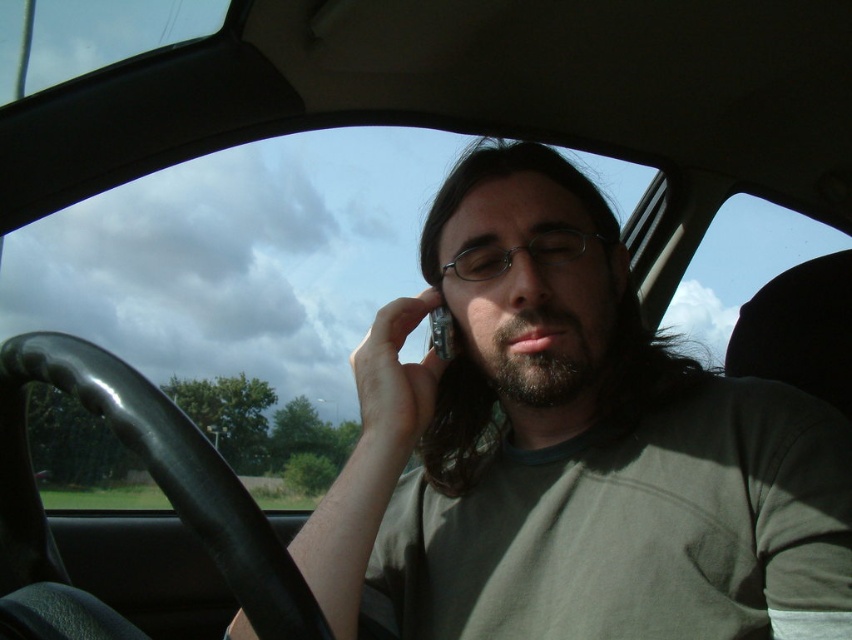
You are a passenger in the car and want to look outside through the transparent glass car window at upper center. Where exactly should you look to see the cloudy sky with patches of blue?

You should look at the transparent glass car window at upper center located at point (242, 285) to see the cloudy sky with patches of blue.

You are a passenger in the car and want to see the view outside without moving your head. Which object should you look through, the transparent glass car window at upper center or the matte black phone at center?

You should look through the transparent glass car window at upper center because it is located below the matte black phone at center, allowing you to see the view outside without moving your head.